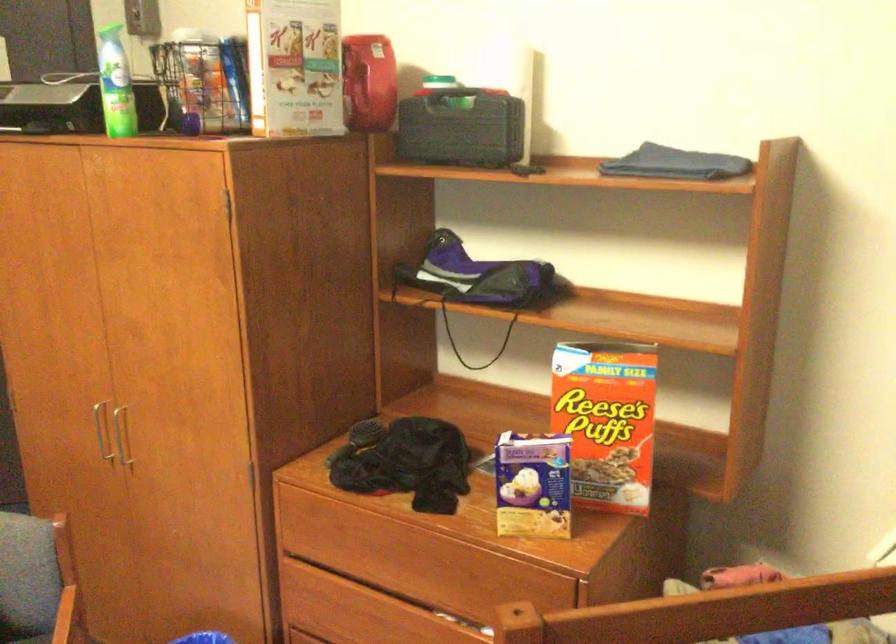
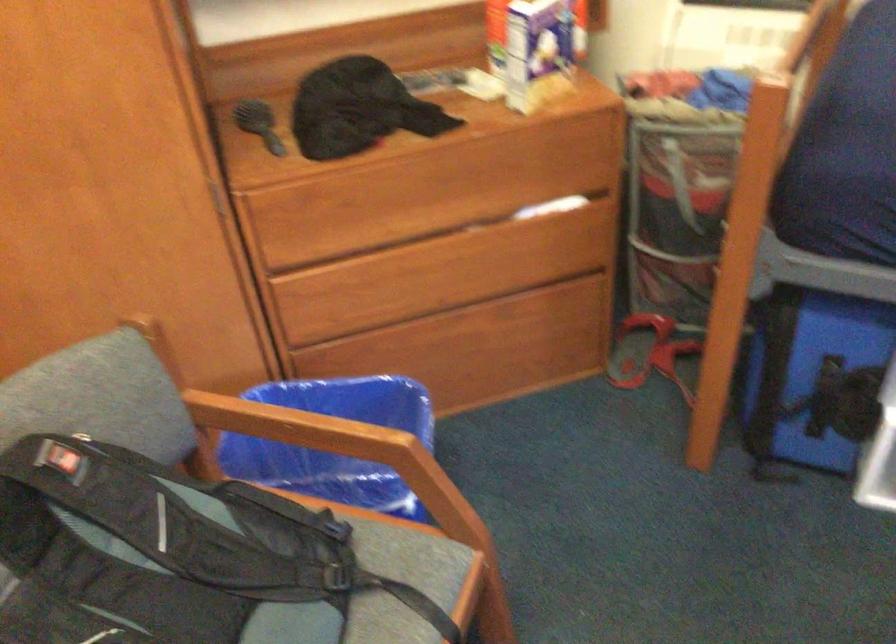
Locate, in the second image, the point that corresponds to [394,514] in the first image.

(401, 151)